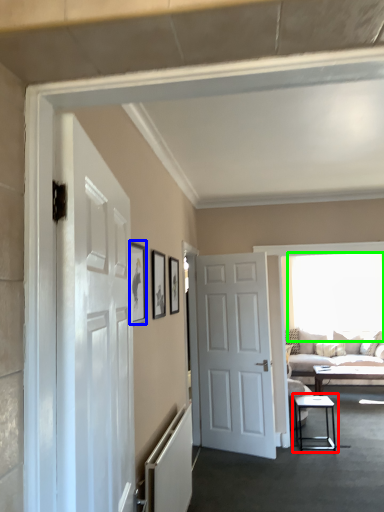
Question: Considering the real-world distances, which object is closest to table (highlighted by a red box)? picture frame (highlighted by a blue box) or window (highlighted by a green box).

Choices:
 (A) picture frame
 (B) window

Answer: (B)